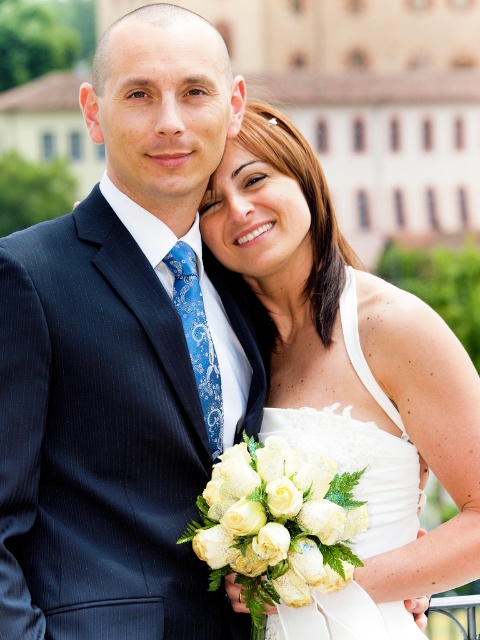
Based on the photo, you are a photographer at a wedding. You need to adjust the lighting to ensure both the white satin dress at center and the white silk bouquet at center are visible. Since they are both white, how can you tell them apart in the image?

The white satin dress at center is located above the white silk bouquet at center, so you can distinguish them by their vertical positions in the image.

In the scene shown: You are a photographer positioned behind the couple. You want to focus your camera on the white silk bouquet at center without blurring the matte black suit at left. Is this possible given their positions?

The matte black suit at left is closer to the viewer than the white silk bouquet at center. To focus on the bouquet while keeping the suit in focus, the camera must have a depth of field sufficient to cover the distance between them. Since the bouquet is farther away, adjusting the aperture to a smaller opening might help maintain both in focus.

You are a photographer trying to capture a closeup of the couple. You notice two points marked in the image. The first point is at coordinate point (180, 172) and the second is at point (252, 436). Which point should you focus on to ensure the foreground subject is sharp?

Point (180, 172) is in front of point (252, 436), so focusing on point (180, 172) will ensure the foreground subject is sharp.